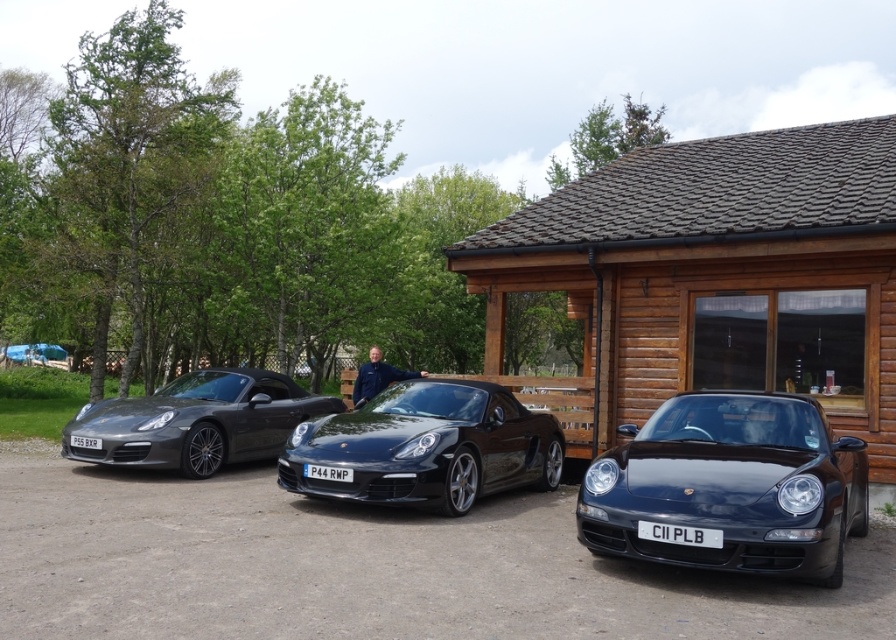
Does glossy black car at center have a lesser width compared to blue fabric jacket at center?

In fact, glossy black car at center might be wider than blue fabric jacket at center.

Is glossy black car at center closer to the viewer compared to blue fabric jacket at center?

That is True.

Is point (735, 468) less distant than point (371, 394)?

That is True.

Find the location of a particular element. The width and height of the screenshot is (896, 640). glossy black car at center is located at coordinates (731, 484).

Can you confirm if metallic gray convertible at left is positioned above white metallic license plate at center?

Indeed, metallic gray convertible at left is positioned over white metallic license plate at center.

Is point (274, 404) positioned behind point (670, 532)?

Yes, point (274, 404) is behind point (670, 532).

Which is in front, point (256, 378) or point (658, 536)?

Positioned in front is point (658, 536).

What are the coordinates of `metallic gray convertible at left` in the screenshot? It's located at (197, 420).

Who is more distant from viewer, (820,250) or (351,481)?

The point (820,250) is behind.

Between wooden cabin at center and white plastic license plate at center, which one is positioned higher?

wooden cabin at center is above.

Does point (642, 236) come behind point (306, 464)?

Yes, point (642, 236) is farther from viewer.

Identify the location of wooden cabin at center. The width and height of the screenshot is (896, 640). (718, 273).